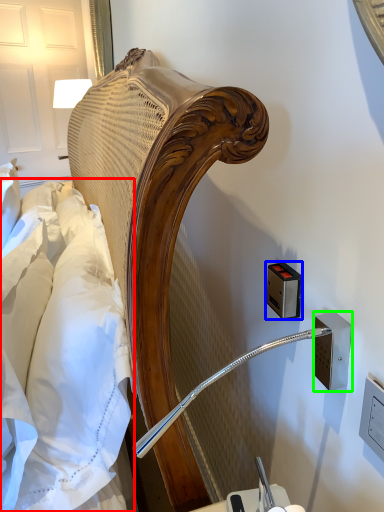
Question: Which object is positioned closest to sheet (highlighted by a red box)? Select from electric outlet (highlighted by a blue box) and electric outlet (highlighted by a green box).

Choices:
 (A) electric outlet
 (B) electric outlet

Answer: (A)